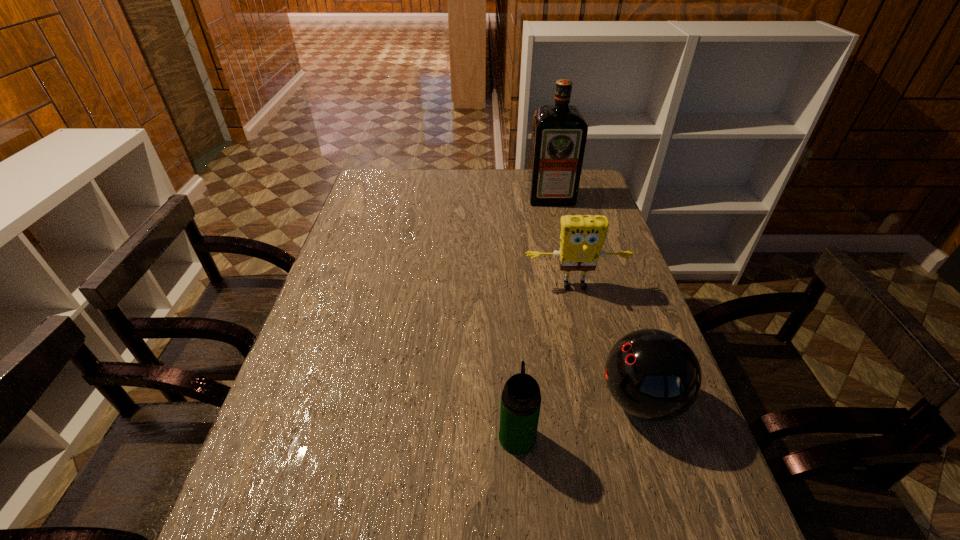
The image size is (960, 540). What are the coordinates of `vacant space located on the surface of the bowling ball near the finger holes` in the screenshot? It's located at (546, 400).

Locate an element on the screen. vacant area situated on the surface of the bowling ball near the finger holes is located at coordinates point(501,400).

The height and width of the screenshot is (540, 960). In order to click on vacant region located on the surface of the bowling ball near the finger holes in this screenshot , I will do click(488, 400).

In order to click on object that is at the far edge in this screenshot , I will do `click(559, 132)`.

Identify the location of liquor that is at the right edge. (559, 132).

Find the location of a particular element. sponge located at the right edge is located at coordinates 581,239.

Find the location of a particular element. Image resolution: width=960 pixels, height=540 pixels. bowling ball that is at the right edge is located at coordinates (652, 374).

Find the location of a particular element. The height and width of the screenshot is (540, 960). object that is at the far right corner is located at coordinates (559, 132).

I want to click on vacant space at the far edge, so point(447,175).

In the image, there is a desktop. In order to click on vacant region at the left edge in this screenshot , I will do `click(300, 348)`.